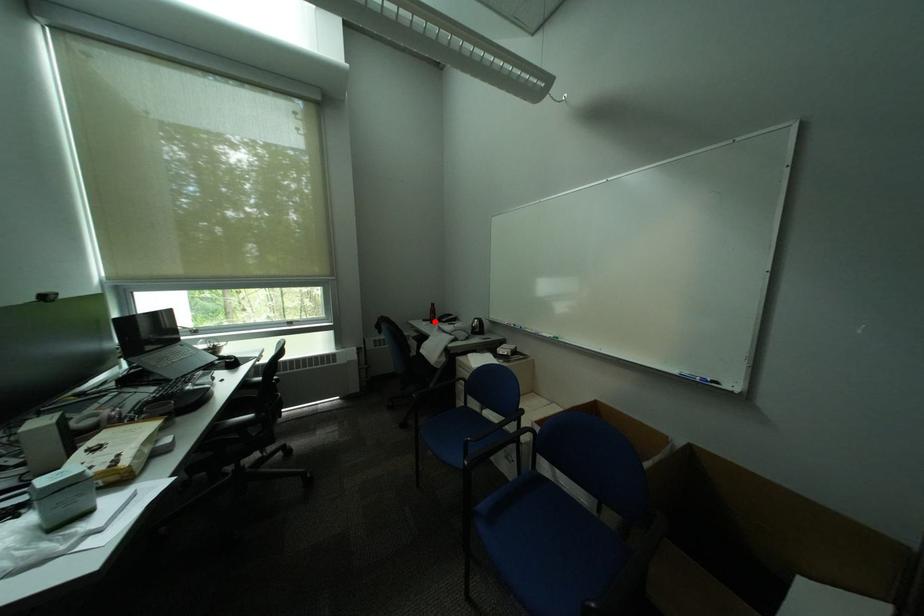
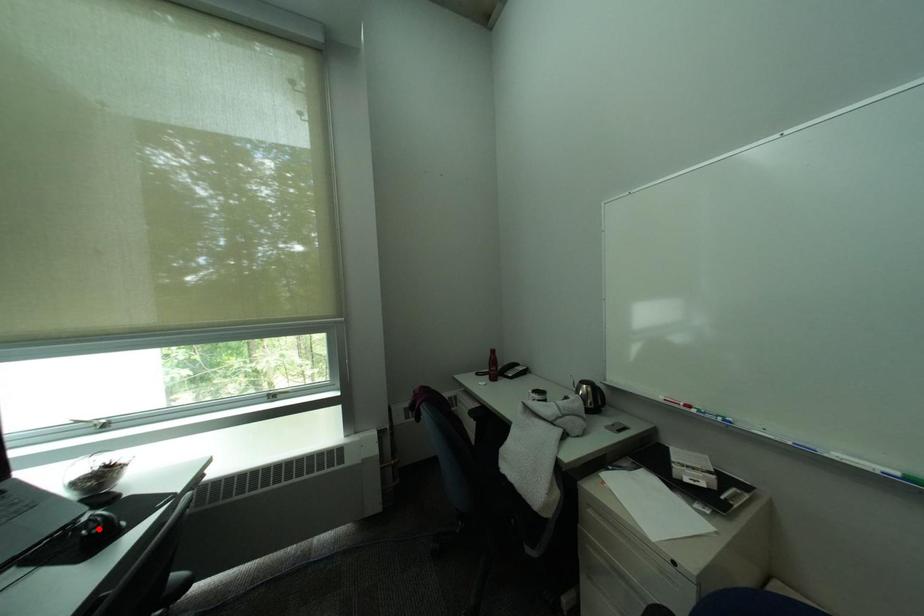
I am providing you with two images of the same scene from different viewpoints. A red point is marked on the first image and another point is marked on the second image. Does the point marked in image1 correspond to the same location as the one in image2?

No